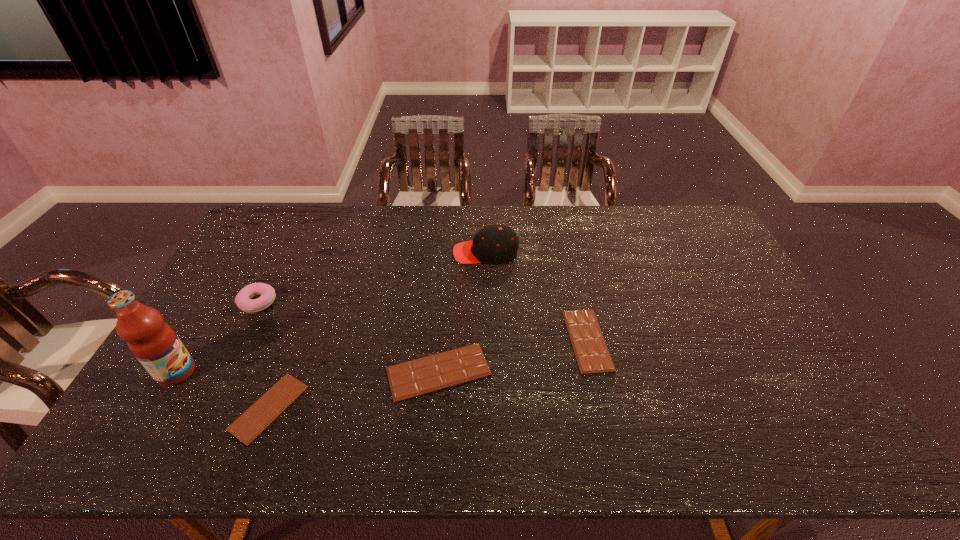
Identify the location of free spot between the tallest object and the second object from left to right. The image size is (960, 540). (217, 338).

This screenshot has width=960, height=540. In order to click on free space between the cap and the fruit juice in this screenshot , I will do `click(331, 313)`.

Image resolution: width=960 pixels, height=540 pixels. I want to click on free spot between the farthest object and the tallest object, so click(331, 313).

Locate an element on the screen. This screenshot has height=540, width=960. unoccupied position between the tallest object and the second shortest chocolate bar is located at coordinates (382, 356).

The width and height of the screenshot is (960, 540). I want to click on unoccupied area between the farthest object and the leftmost object, so click(x=331, y=313).

Where is `unoccupied area between the fruit juice and the third object from left to right`? This screenshot has width=960, height=540. unoccupied area between the fruit juice and the third object from left to right is located at coordinates (223, 390).

Locate an element on the screen. This screenshot has height=540, width=960. empty location between the second tallest chocolate bar and the tallest object is located at coordinates (382, 356).

Find the location of `vacant space that's between the third tallest object and the leftmost object`. vacant space that's between the third tallest object and the leftmost object is located at coordinates (217, 338).

Identify which object is the fifth closest to the second chocolate bar from right to left. Please provide its 2D coordinates. Your answer should be formatted as a tuple, i.e. [(x, y)], where the tuple contains the x and y coordinates of a point satisfying the conditions above.

[(153, 342)]

Locate which object is the third closest to the tallest object. Please provide its 2D coordinates. Your answer should be formatted as a tuple, i.e. [(x, y)], where the tuple contains the x and y coordinates of a point satisfying the conditions above.

[(432, 373)]